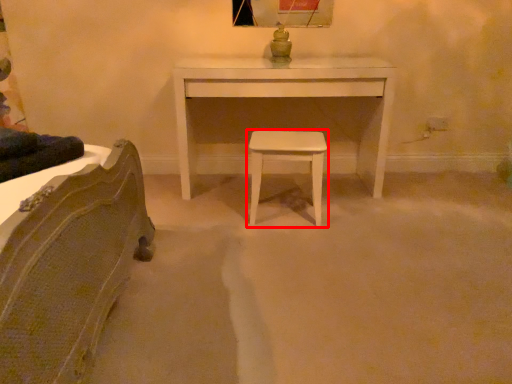
Question: Observing the image, what is the correct spatial positioning of stool (annotated by the red box) in reference to table?

Choices:
 (A) left
 (B) right

Answer: (B)